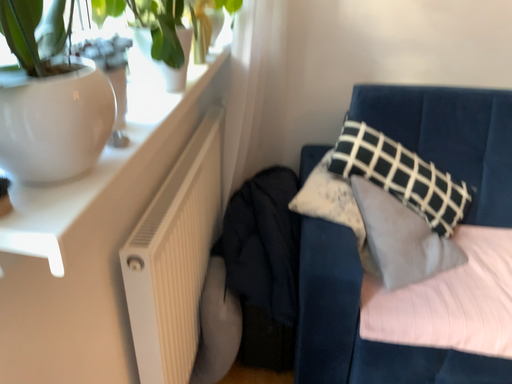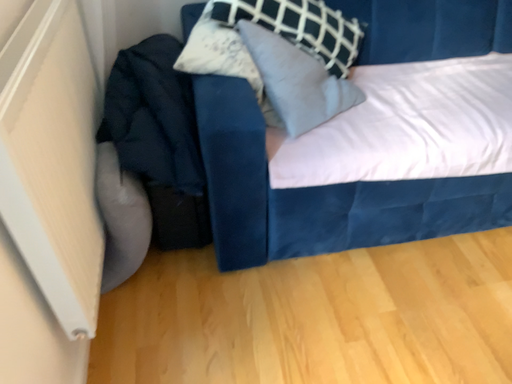
Question: Which way did the camera rotate in the video?

Choices:
 (A) rotated downward
 (B) rotated upward

Answer: (A)